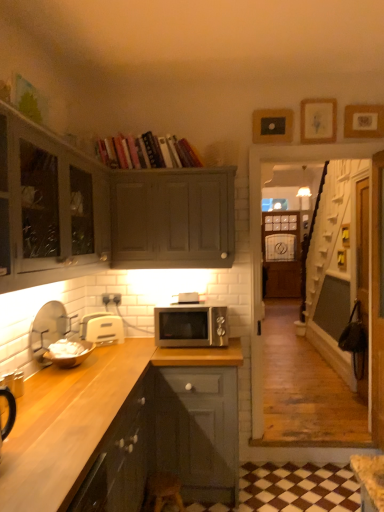
Describe the element at coordinates (187, 298) in the screenshot. This screenshot has width=384, height=512. I see `silver metallic microwave at center, which is the first appliance from right to left` at that location.

Locate an element on the screen. matte gray cabinet at upper left, which appears as the 2th cabinetry when viewed from the top is located at coordinates (49, 207).

What do you see at coordinates (364, 121) in the screenshot?
I see `wooden picture frame at upper right, arranged as the 1th picture frame when viewed from the right` at bounding box center [364, 121].

Locate an element on the screen. The width and height of the screenshot is (384, 512). matte gray cabinet at upper center, which ranks as the 3th cabinetry in bottom-to-top order is located at coordinates (173, 218).

Find the location of a particular element. The image size is (384, 512). silver metallic microwave at center, which is the first appliance from right to left is located at coordinates (187, 298).

Considering the sizes of objects white matte bowl at left, the first appliance viewed from the left, and white plastic toaster at lower left, arranged as the second appliance when viewed from the right, in the image provided, who is bigger, white matte bowl at left, the first appliance viewed from the left, or white plastic toaster at lower left, arranged as the second appliance when viewed from the right,?

white matte bowl at left, the first appliance viewed from the left.

From the image's perspective, is white matte bowl at left, the fourth appliance in the right-to-left sequence, over white plastic toaster at lower left, which is the third appliance from left to right?

Indeed, from the image's perspective, white matte bowl at left, the fourth appliance in the right-to-left sequence, is shown above white plastic toaster at lower left, which is the third appliance from left to right.

From a real-world perspective, between white matte bowl at left, the fourth appliance in the right-to-left sequence, and white plastic toaster at lower left, arranged as the second appliance when viewed from the right, who is vertically higher?

In real-world perspective, white matte bowl at left, the fourth appliance in the right-to-left sequence, is above.

Which appliance is the 3rd one when counting from the front of the white plastic toaster at lower left, which is the third appliance from left to right? Please provide its 2D coordinates.

[(48, 329)]

Between matte gray cabinet at upper left, which appears as the 2th cabinetry when viewed from the top, and dark wood countertop at lower left, placed as the third cabinetry when sorted from top to bottom, which one appears on the left side from the viewer's perspective?

matte gray cabinet at upper left, which appears as the 2th cabinetry when viewed from the top, is more to the left.

What's the angular difference between matte gray cabinet at upper left, which ranks as the 2th cabinetry in bottom-to-top order, and dark wood countertop at lower left, which is the 1th cabinetry from bottom to top,'s facing directions?

There is a 2.7-degree angle between the facing directions of matte gray cabinet at upper left, which ranks as the 2th cabinetry in bottom-to-top order, and dark wood countertop at lower left, which is the 1th cabinetry from bottom to top.

From a real-world perspective, starting from the dark wood countertop at lower left, placed as the third cabinetry when sorted from top to bottom, which cabinetry is the 2nd one vertically above it? Please provide its 2D coordinates.

[(49, 207)]

In the scene shown: From a real-world perspective, is transparent glass door at right above or below hardcover books at upper center?

Clearly, from a real-world perspective, transparent glass door at right is below hardcover books at upper center.

What's the angular difference between transparent glass door at right and hardcover books at upper center's facing directions?

90.5 degrees separate the facing orientations of transparent glass door at right and hardcover books at upper center.

Find the location of `glass door behind the hardcover books at upper center`. glass door behind the hardcover books at upper center is located at coordinates (362, 281).

Is matte gray cabinet at upper left, which ranks as the 2th cabinetry in bottom-to-top order, aimed at black matte picture frame at upper center, which appears as the third picture frame when viewed from the right?

No, matte gray cabinet at upper left, which ranks as the 2th cabinetry in bottom-to-top order, is not oriented towards black matte picture frame at upper center, which appears as the third picture frame when viewed from the right.

Does matte gray cabinet at upper left, which appears as the 2th cabinetry when viewed from the top, have a smaller size compared to black matte picture frame at upper center, positioned as the 1th picture frame in left-to-right order?

Actually, matte gray cabinet at upper left, which appears as the 2th cabinetry when viewed from the top, might be larger than black matte picture frame at upper center, positioned as the 1th picture frame in left-to-right order.

Is matte gray cabinet at upper left, which ranks as the 2th cabinetry in bottom-to-top order, at the right side of black matte picture frame at upper center, positioned as the 1th picture frame in left-to-right order?

Result: Incorrect, matte gray cabinet at upper left, which ranks as the 2th cabinetry in bottom-to-top order, is not on the right side of black matte picture frame at upper center, positioned as the 1th picture frame in left-to-right order.

Which is behind, matte gray cabinet at upper left, which ranks as the 2th cabinetry in bottom-to-top order, or black matte picture frame at upper center, positioned as the 1th picture frame in left-to-right order?

black matte picture frame at upper center, positioned as the 1th picture frame in left-to-right order.

Is the surface of wooden stool at lower center in direct contact with dark wood countertop at lower left, placed as the third cabinetry when sorted from top to bottom?

No, wooden stool at lower center is not with dark wood countertop at lower left, placed as the third cabinetry when sorted from top to bottom.

Who is smaller, wooden stool at lower center or dark wood countertop at lower left, placed as the third cabinetry when sorted from top to bottom?

wooden stool at lower center is smaller.

Could you measure the distance between wooden stool at lower center and dark wood countertop at lower left, placed as the third cabinetry when sorted from top to bottom?

wooden stool at lower center is 15.78 inches away from dark wood countertop at lower left, placed as the third cabinetry when sorted from top to bottom.

Consider the image. Is wooden stool at lower center spatially inside dark wood countertop at lower left, which is the 1th cabinetry from bottom to top, or outside of it?

wooden stool at lower center exists outside the volume of dark wood countertop at lower left, which is the 1th cabinetry from bottom to top.

Can you confirm if wooden picture frame at upper right, arranged as the 1th picture frame when viewed from the right, is smaller than matte gray cabinet at upper left, which ranks as the 2th cabinetry in bottom-to-top order?

Indeed, wooden picture frame at upper right, arranged as the 1th picture frame when viewed from the right, has a smaller size compared to matte gray cabinet at upper left, which ranks as the 2th cabinetry in bottom-to-top order.

From a real-world perspective, between wooden picture frame at upper right, marked as the third picture frame in a left-to-right arrangement, and matte gray cabinet at upper left, which ranks as the 2th cabinetry in bottom-to-top order, who is vertically lower?

In real-world perspective, matte gray cabinet at upper left, which ranks as the 2th cabinetry in bottom-to-top order, is lower.

Locate an element on the screen. the 1st picture frame behind the matte gray cabinet at upper left, which ranks as the 2th cabinetry in bottom-to-top order is located at coordinates (364, 121).

Is there a large distance between wooden picture frame at upper right, arranged as the 1th picture frame when viewed from the right, and matte gray cabinet at upper left, which appears as the 2th cabinetry when viewed from the top?

Result: wooden picture frame at upper right, arranged as the 1th picture frame when viewed from the right, is far away from matte gray cabinet at upper left, which appears as the 2th cabinetry when viewed from the top.

Between white plastic toaster at lower left, arranged as the second appliance when viewed from the right, and wooden picture frame at upper right, arranged as the 1th picture frame when viewed from the right, which one is positioned in front?

white plastic toaster at lower left, arranged as the second appliance when viewed from the right, is in front.

Is white plastic toaster at lower left, which is the third appliance from left to right, shorter than wooden picture frame at upper right, arranged as the 1th picture frame when viewed from the right?

No, white plastic toaster at lower left, which is the third appliance from left to right, is not shorter than wooden picture frame at upper right, arranged as the 1th picture frame when viewed from the right.

Is white plastic toaster at lower left, which is the third appliance from left to right, looking in the opposite direction of wooden picture frame at upper right, marked as the third picture frame in a left-to-right arrangement?

white plastic toaster at lower left, which is the third appliance from left to right, is not turned away from wooden picture frame at upper right, marked as the third picture frame in a left-to-right arrangement.

Where is `the 1st appliance below the white matte bowl at left, the fourth appliance in the right-to-left sequence (from the image's perspective)`? The width and height of the screenshot is (384, 512). the 1st appliance below the white matte bowl at left, the fourth appliance in the right-to-left sequence (from the image's perspective) is located at coordinates (102, 328).

Where is `cabinetry lying on the left of dark wood countertop at lower left, placed as the third cabinetry when sorted from top to bottom`? The image size is (384, 512). cabinetry lying on the left of dark wood countertop at lower left, placed as the third cabinetry when sorted from top to bottom is located at coordinates (49, 207).

From the image, which object appears to be farther from transparent glass door at right, white plastic toaster at lower left, which is the third appliance from left to right, or hardcover books at upper center?

Based on the image, white plastic toaster at lower left, which is the third appliance from left to right, appears to be further to transparent glass door at right.

Based on the photo, looking at the image, which one is located further to wooden stool at lower center, wooden picture frame at upper right, marked as the third picture frame in a left-to-right arrangement, or white plastic toaster at lower left, which is the third appliance from left to right?

wooden picture frame at upper right, marked as the third picture frame in a left-to-right arrangement.

Which object lies nearer to the anchor point black matte picture frame at upper center, positioned as the 1th picture frame in left-to-right order, satin silver microwave at center or white matte bowl at left, the 2th appliance when ordered from left to right?

Based on the image, satin silver microwave at center appears to be nearer to black matte picture frame at upper center, positioned as the 1th picture frame in left-to-right order.

Consider the image. Estimate the real-world distances between objects in this image. Which object is closer to dark wood countertop at lower left, placed as the third cabinetry when sorted from top to bottom, matte gray cabinet at upper left, which appears as the 2th cabinetry when viewed from the top, or satin silver microwave at center?

Among the two, satin silver microwave at center is located nearer to dark wood countertop at lower left, placed as the third cabinetry when sorted from top to bottom.

From the image, which object appears to be farther from matte gray cabinet at upper center, which ranks as the 3th cabinetry in bottom-to-top order, white matte bowl at left, the fourth appliance in the right-to-left sequence, or hardcover books at upper center?

Based on the image, white matte bowl at left, the fourth appliance in the right-to-left sequence, appears to be further to matte gray cabinet at upper center, which ranks as the 3th cabinetry in bottom-to-top order.

Considering their positions, is transparent glass door at right positioned further to wooden picture frame at upper center, which is counted as the 2th picture frame, starting from the right, than silver metallic microwave at center, the fourth appliance in the left-to-right sequence?

Among the two, silver metallic microwave at center, the fourth appliance in the left-to-right sequence, is located further to wooden picture frame at upper center, which is counted as the 2th picture frame, starting from the right.

Considering their positions, is dark wood countertop at lower left, placed as the third cabinetry when sorted from top to bottom, positioned closer to hardcover books at upper center than wooden picture frame at upper center, which is counted as the 2th picture frame, starting from the right?

wooden picture frame at upper center, which is counted as the 2th picture frame, starting from the right, lies closer to hardcover books at upper center than the other object.

Based on the photo, considering their positions, is white matte bowl at left, the 2th appliance when ordered from left to right, positioned closer to black matte picture frame at upper center, which appears as the third picture frame when viewed from the right, than white matte bowl at left, the fourth appliance in the right-to-left sequence?

white matte bowl at left, the fourth appliance in the right-to-left sequence, lies closer to black matte picture frame at upper center, which appears as the third picture frame when viewed from the right, than the other object.

Locate an element on the screen. The image size is (384, 512). glass door between hardcover books at upper center and wooden stool at lower center in the vertical direction is located at coordinates (362, 281).

You are a GUI agent. You are given a task and a screenshot of the screen. Output one action in this format:
    pyautogui.click(x=<x>, y=<y>)
    Task: Click on the appliance between matte gray cabinet at upper center, which ranks as the 1th cabinetry in top-to-bottom order, and wooden picture frame at upper right, arranged as the 1th picture frame when viewed from the right
    The width and height of the screenshot is (384, 512).
    Given the screenshot: What is the action you would take?
    pyautogui.click(x=187, y=298)

This screenshot has height=512, width=384. I want to click on microwave oven between dark wood countertop at lower left, placed as the third cabinetry when sorted from top to bottom, and transparent glass door at right, so click(190, 326).

Find the location of a particular element. microwave oven located between hardcover books at upper center and wooden picture frame at upper right, arranged as the 1th picture frame when viewed from the right, in the left-right direction is located at coordinates (190, 326).